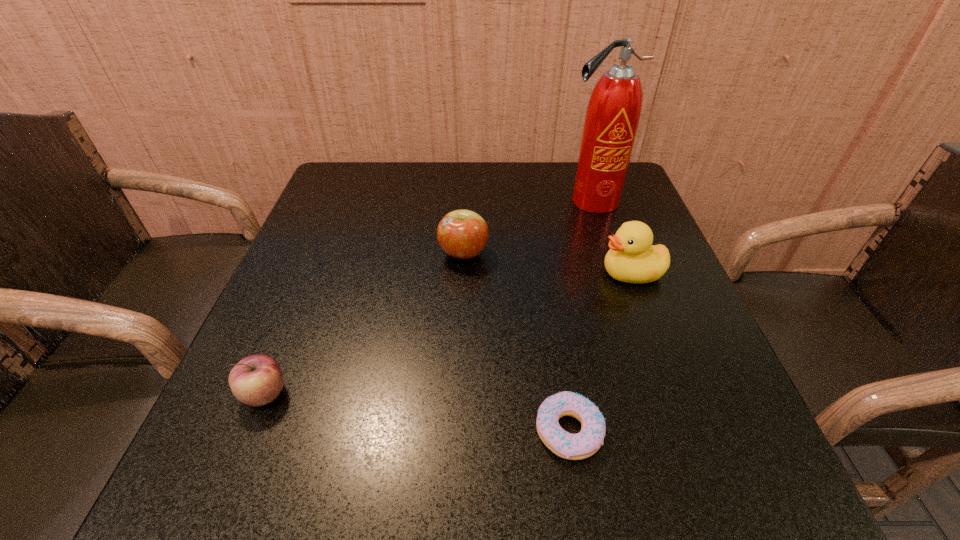
At what (x,y) coordinates should I click in order to perform the action: click on free region located at the beak of the fourth shortest object. Please return your answer as a coordinate pair (x, y). Image resolution: width=960 pixels, height=540 pixels. Looking at the image, I should click on (480, 273).

At what (x,y) coordinates should I click in order to perform the action: click on vacant space located 0.100m at the beak of the fourth shortest object. Please return your answer as a coordinate pair (x, y). The height and width of the screenshot is (540, 960). Looking at the image, I should click on (551, 273).

Where is `free region located 0.110m at the beak of the fourth shortest object`? The height and width of the screenshot is (540, 960). free region located 0.110m at the beak of the fourth shortest object is located at coordinates (546, 273).

In order to click on vacant area located on the left of the right apple in this screenshot , I will do `click(384, 253)`.

The height and width of the screenshot is (540, 960). I want to click on vacant region located on the right of the leftmost object, so click(x=505, y=394).

Find the location of a particular element. Image resolution: width=960 pixels, height=540 pixels. free space located on the back of the shortest object is located at coordinates (554, 334).

In order to click on object that is positioned at the far edge in this screenshot , I will do `click(614, 109)`.

You are a GUI agent. You are given a task and a screenshot of the screen. Output one action in this format:
    pyautogui.click(x=<x>, y=<y>)
    Task: Click on the object that is at the near edge
    This screenshot has height=540, width=960.
    Given the screenshot: What is the action you would take?
    pyautogui.click(x=587, y=442)

Find the location of a particular element. object that is at the left edge is located at coordinates (256, 380).

This screenshot has height=540, width=960. Identify the location of fire extinguisher present at the right edge. (614, 109).